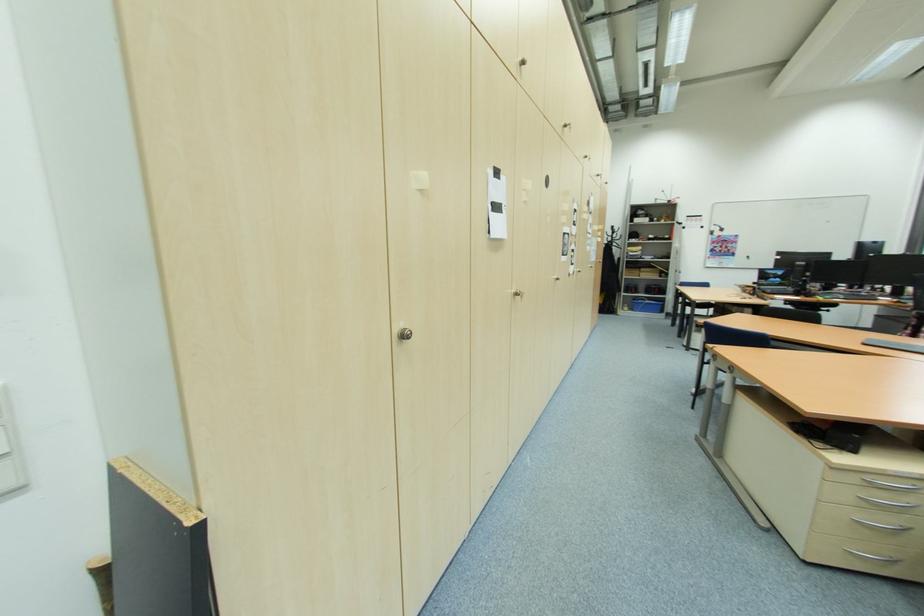
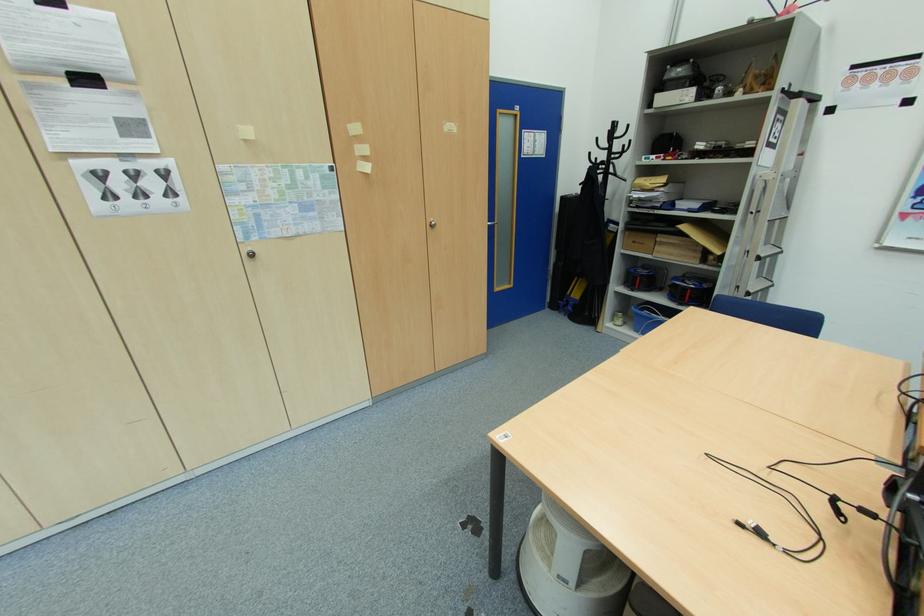
In the second image, find the point that corresponds to the point at 641,301 in the first image.

(646, 310)